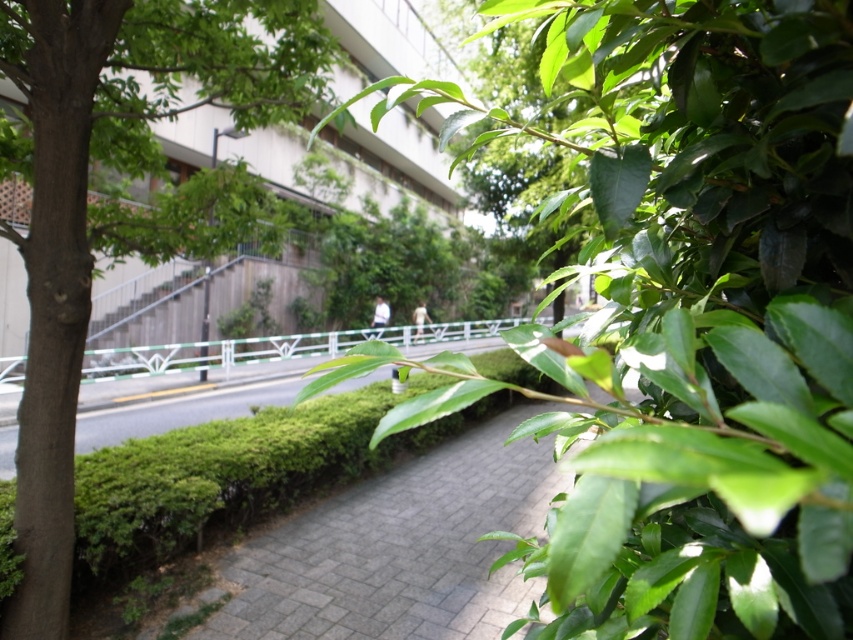
Does green leafy tree at center lie behind green leafy tree at left?

No, green leafy tree at center is closer to the viewer.

Is green leafy tree at center positioned in front of green leafy tree at left?

Yes, it is in front of green leafy tree at left.

Find the location of a particular element. green leafy tree at center is located at coordinates (688, 316).

Find the location of a particular element. The image size is (853, 640). green leafy tree at center is located at coordinates (688, 316).